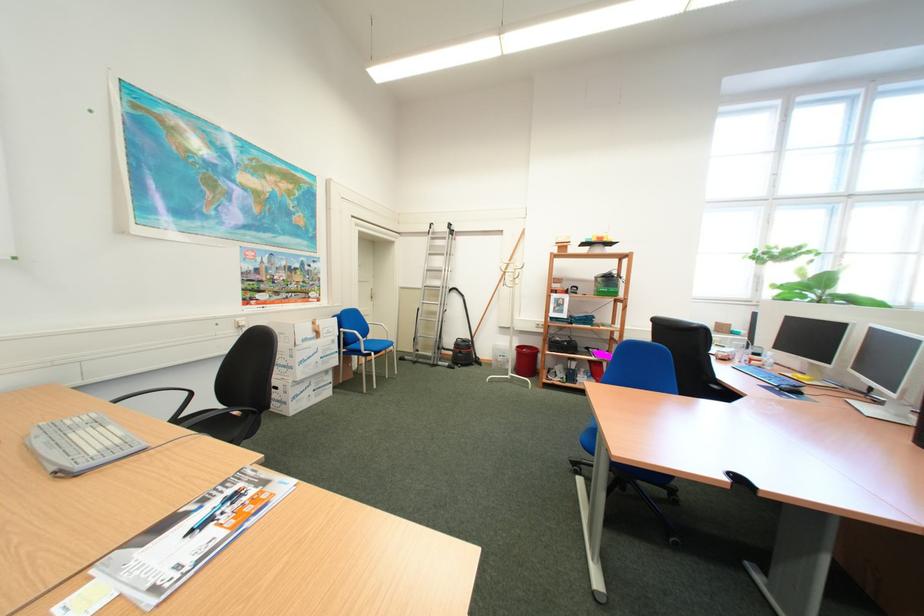
Find the location of a particular element. red trash bin is located at coordinates (526, 360).